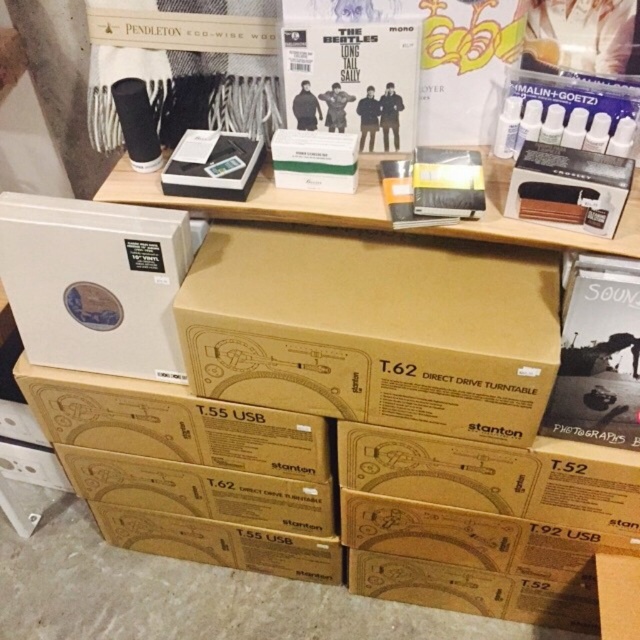
You are standing in front of a wooden shelf with items displayed. There is a point marked at coordinates (96, 282). Which object is this point located on?

The point at coordinates (96, 282) is located on the white matte vinyl record at lower left.

You are organizing a music collection and need to place the white matte vinyl record at lower left and the matte cardboard box at lower right on a shelf. Which item requires more horizontal space due to its greater width?

The white matte vinyl record at lower left requires more horizontal space because its width surpasses that of the matte cardboard box at lower right.